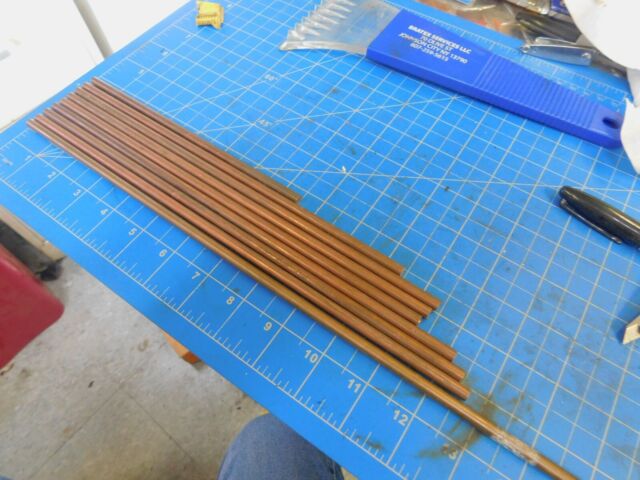
Locate an element on the screen. This screenshot has width=640, height=480. cutting pad is located at coordinates (493, 258).